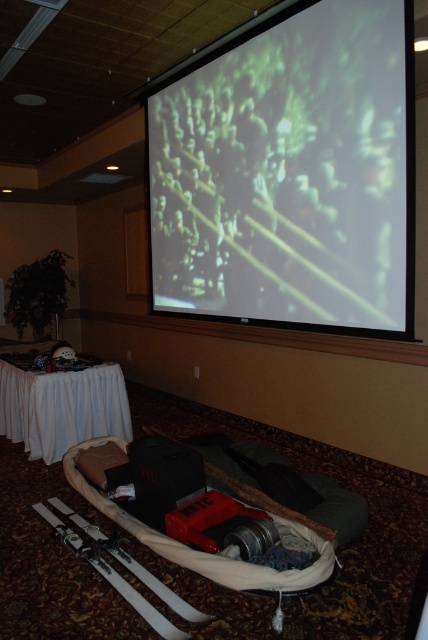
Question: Is matte white screen at upper center to the right of white cloth table at lower left from the viewer's perspective?

Choices:
 (A) yes
 (B) no

Answer: (A)

Question: Which object appears closest to the camera in this image?

Choices:
 (A) white cloth table at lower left
 (B) matte white screen at upper center

Answer: (B)

Question: Which point is closer to the camera?

Choices:
 (A) (12, 401)
 (B) (249, 141)

Answer: (B)

Question: Is matte white screen at upper center positioned in front of white cloth table at lower left?

Choices:
 (A) no
 (B) yes

Answer: (B)

Question: Does matte white screen at upper center appear over white cloth table at lower left?

Choices:
 (A) no
 (B) yes

Answer: (B)